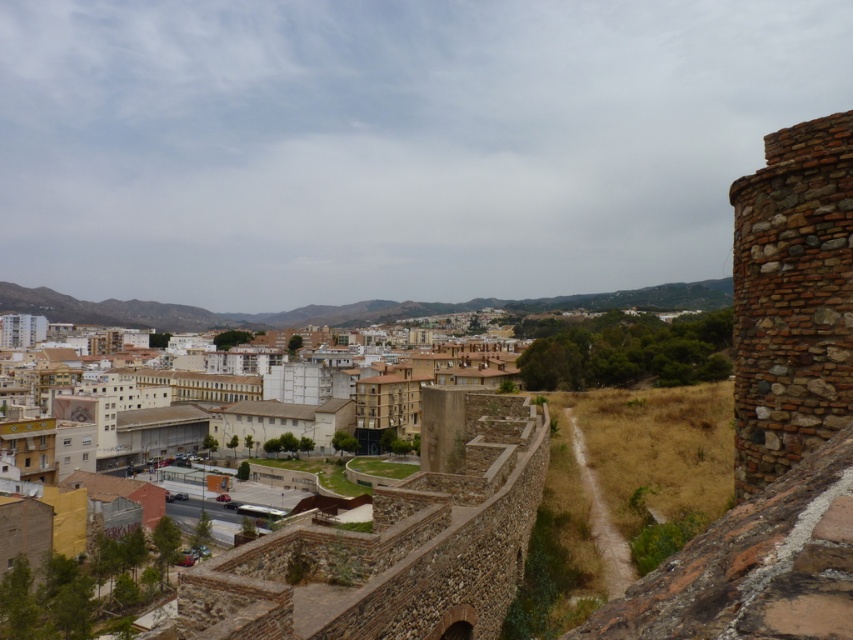
You are a city planner assessing the view from the castle wall. You need to determine if the white concrete buildings at center will block the view of the brown stone tower at right from the path below. Based on their widths, can you conclude which structure is wider and might obstruct the view?

The white concrete buildings at center are wider than the brown stone tower at right. Since the white concrete buildings at center are wider, they could potentially block the view of the brown stone tower at right from the path below depending on their positioning.

You are a tourist standing on the elevated stone wall and want to take a photo that captures both the white concrete buildings at center and the brown stone tower at right. Which object will appear smaller in the photo?

The white concrete buildings at center will appear smaller in the photo because they have a lesser height compared to the brown stone tower at right.

You are a tourist standing on the elevated stone wall and want to take a photo of the city. The white concrete buildings at center and the brown stone tower at right are both in your view. According to the scene, which object is positioned lower in the frame?

The white concrete buildings at center are positioned lower in the frame than the brown stone tower at right.